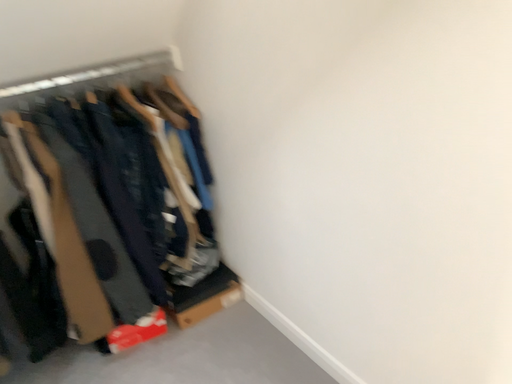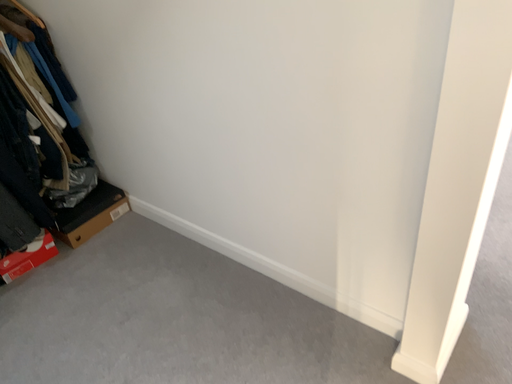
Question: Which way did the camera rotate in the video?

Choices:
 (A) rotated upward
 (B) rotated downward

Answer: (B)